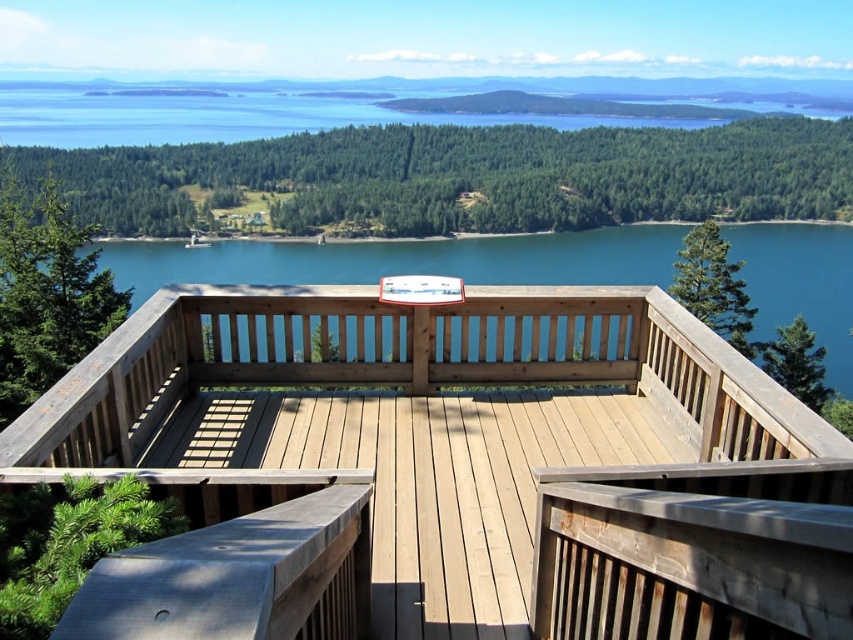
Question: Which of the following is the farthest from the observer?

Choices:
 (A) (376, 480)
 (B) (686, 228)

Answer: (B)

Question: Does natural wood deck at center appear over blue wooden water at center?

Choices:
 (A) no
 (B) yes

Answer: (A)

Question: Is natural wood deck at center bigger than blue wooden water at center?

Choices:
 (A) no
 (B) yes

Answer: (A)

Question: Which of the following is the farthest from the observer?

Choices:
 (A) (701, 406)
 (B) (294, 243)

Answer: (B)

Question: Does natural wood deck at center lie behind blue wooden water at center?

Choices:
 (A) no
 (B) yes

Answer: (A)

Question: Which point appears farthest from the camera in this image?

Choices:
 (A) (599, 522)
 (B) (838, 323)

Answer: (B)